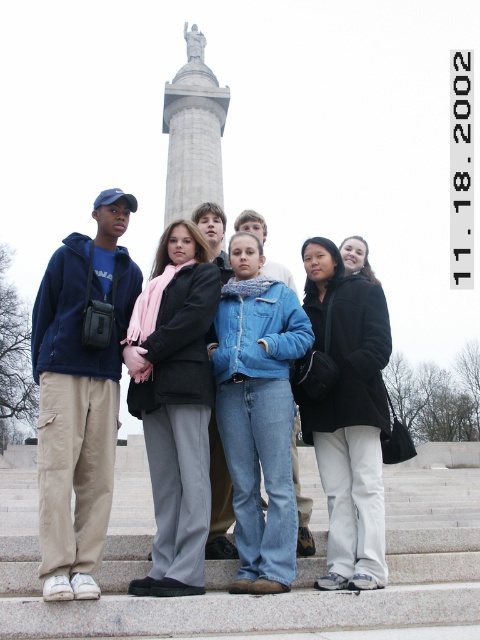
Question: Which object is positioned closest to the black matte jacket at center?

Choices:
 (A) matte black jacket at center
 (B) black wool coat at center
 (C) gray stone column at center

Answer: (B)

Question: Is the position of black matte jacket at center less distant than that of matte black jacket at center?

Choices:
 (A) no
 (B) yes

Answer: (B)

Question: Among these points, which one is nearest to the camera?

Choices:
 (A) pos(215,112)
 (B) pos(166,360)
 (C) pos(344,252)

Answer: (B)

Question: Which is farther from the black wool coat at center?

Choices:
 (A) matte black jacket at center
 (B) black matte jacket at center
 (C) gray stone column at center

Answer: (C)

Question: From the image, what is the correct spatial relationship of gray stone column at center in relation to matte black jacket at center?

Choices:
 (A) left
 (B) right

Answer: (A)

Question: Where is black wool coat at center located in relation to gray stone column at center in the image?

Choices:
 (A) left
 (B) right

Answer: (B)